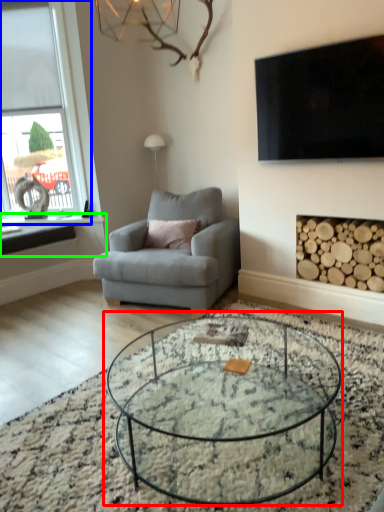
Question: Based on their relative distances, which object is nearer to coffee table (highlighted by a red box)? Choose from window (highlighted by a blue box) and window sill (highlighted by a green box).

Choices:
 (A) window
 (B) window sill

Answer: (B)